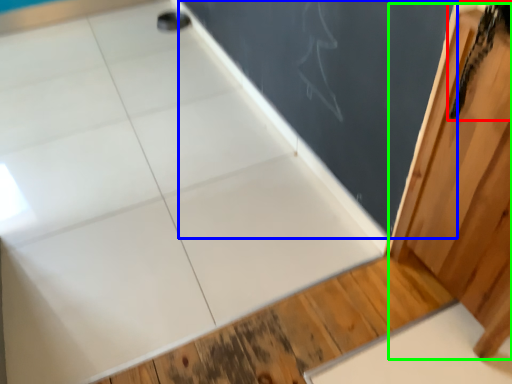
Question: Which object is positioned farthest from animal (highlighted by a red box)? Select from bulletin board (highlighted by a blue box) and barn door (highlighted by a green box).

Choices:
 (A) bulletin board
 (B) barn door

Answer: (A)